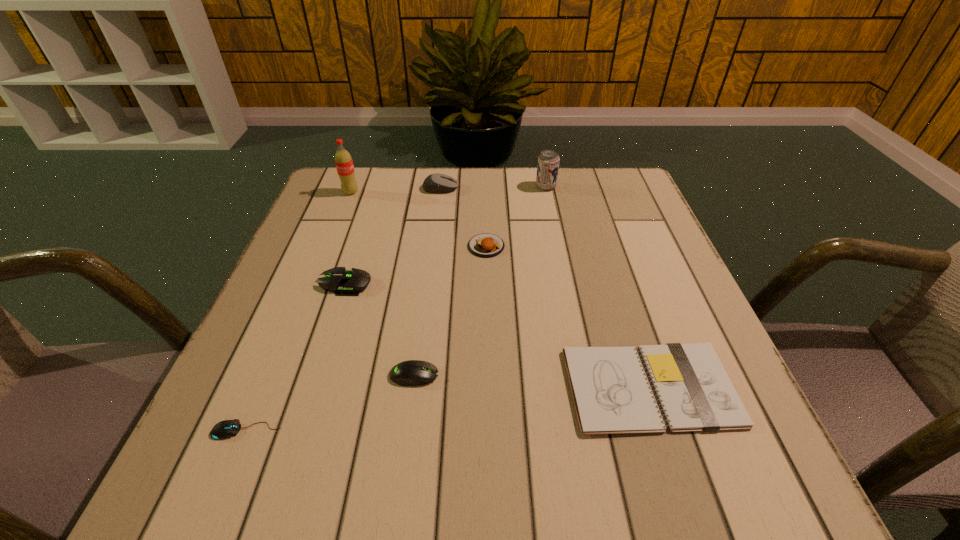
The width and height of the screenshot is (960, 540). I want to click on free space located on the front of the soda, so click(343, 212).

Locate an element on the screen. The width and height of the screenshot is (960, 540). free space located on the back of the second tallest object is located at coordinates click(x=542, y=168).

Locate an element on the screen. vacant space located 0.400m on the wheel side of the sixth shortest object is located at coordinates (610, 188).

I want to click on vacant area located 0.150m on the right of the fifth nearest object, so click(571, 246).

Image resolution: width=960 pixels, height=540 pixels. I want to click on vacant space located 0.190m on the front of the fourth nearest object, so click(x=316, y=377).

The width and height of the screenshot is (960, 540). I want to click on vacant space located on the wheel side of the second nearest mouse, so click(x=612, y=375).

Locate an element on the screen. The width and height of the screenshot is (960, 540). free space located on the back of the notepad is located at coordinates pos(606,252).

What are the coordinates of `vacant space located on the right of the shortest mouse` in the screenshot? It's located at (517, 430).

Image resolution: width=960 pixels, height=540 pixels. I want to click on soda positioned at the far edge, so click(344, 164).

Where is `beer can that is at the far edge`? beer can that is at the far edge is located at coordinates (548, 161).